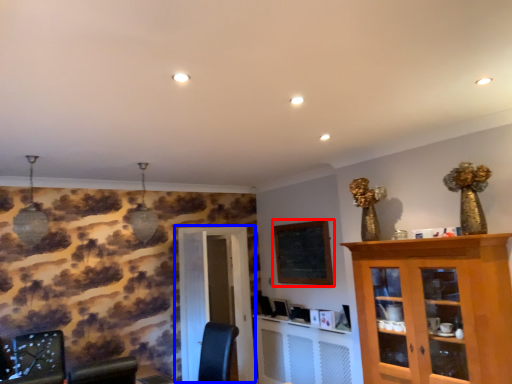
Question: Which of the following is the closest to the observer, bulletin board (highlighted by a red box) or door (highlighted by a blue box)?

Choices:
 (A) bulletin board
 (B) door

Answer: (A)